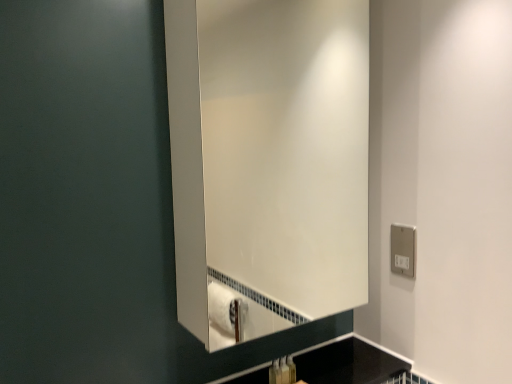
Question: Considering the relative positions of silver metallic electric outlet at right and translucent plastic soap dispenser at lower center, which is counted as the 1th toiletry, starting from the left, in the image provided, is silver metallic electric outlet at right in front of translucent plastic soap dispenser at lower center, which is counted as the 1th toiletry, starting from the left,?

Choices:
 (A) yes
 (B) no

Answer: (B)

Question: Can you confirm if silver metallic electric outlet at right is wider than translucent plastic soap dispenser at lower center, the 2th toiletry viewed from the right?

Choices:
 (A) no
 (B) yes

Answer: (A)

Question: Can you confirm if silver metallic electric outlet at right is positioned to the right of translucent plastic soap dispenser at lower center, the 2th toiletry viewed from the right?

Choices:
 (A) no
 (B) yes

Answer: (B)

Question: Considering the relative sizes of silver metallic electric outlet at right and translucent plastic soap dispenser at lower center, which is counted as the 1th toiletry, starting from the left, in the image provided, is silver metallic electric outlet at right thinner than translucent plastic soap dispenser at lower center, which is counted as the 1th toiletry, starting from the left,?

Choices:
 (A) yes
 (B) no

Answer: (A)

Question: From the image's perspective, does silver metallic electric outlet at right appear higher than translucent plastic soap dispenser at lower center, which is counted as the 1th toiletry, starting from the left?

Choices:
 (A) no
 (B) yes

Answer: (B)

Question: Is translucent plastic soap dispenser at lower center, which is counted as the 1th toiletry, starting from the left, in front of or behind white glossy mirror at center in the image?

Choices:
 (A) front
 (B) behind

Answer: (B)

Question: Is point (278, 380) positioned closer to the camera than point (188, 218)?

Choices:
 (A) farther
 (B) closer

Answer: (A)

Question: Is translucent plastic soap dispenser at lower center, the 2th toiletry viewed from the right, wider or thinner than white glossy mirror at center?

Choices:
 (A) thin
 (B) wide

Answer: (A)

Question: Is translucent plastic soap dispenser at lower center, which is counted as the 1th toiletry, starting from the left, inside the boundaries of white glossy mirror at center, or outside?

Choices:
 (A) outside
 (B) inside

Answer: (A)

Question: Is point (362, 347) closer or farther from the camera than point (226, 89)?

Choices:
 (A) farther
 (B) closer

Answer: (B)

Question: Is black glossy countertop at lower center wider or thinner than white glossy mirror at center?

Choices:
 (A) thin
 (B) wide

Answer: (B)

Question: From their relative heights in the image, would you say black glossy countertop at lower center is taller or shorter than white glossy mirror at center?

Choices:
 (A) short
 (B) tall

Answer: (A)

Question: From the image's perspective, is black glossy countertop at lower center above or below white glossy mirror at center?

Choices:
 (A) above
 (B) below

Answer: (B)

Question: Considering the positions of silver metallic electric outlet at right and black glossy countertop at lower center in the image, is silver metallic electric outlet at right taller or shorter than black glossy countertop at lower center?

Choices:
 (A) short
 (B) tall

Answer: (B)

Question: Considering the positions of point (396, 261) and point (327, 382), is point (396, 261) closer or farther from the camera than point (327, 382)?

Choices:
 (A) farther
 (B) closer

Answer: (B)